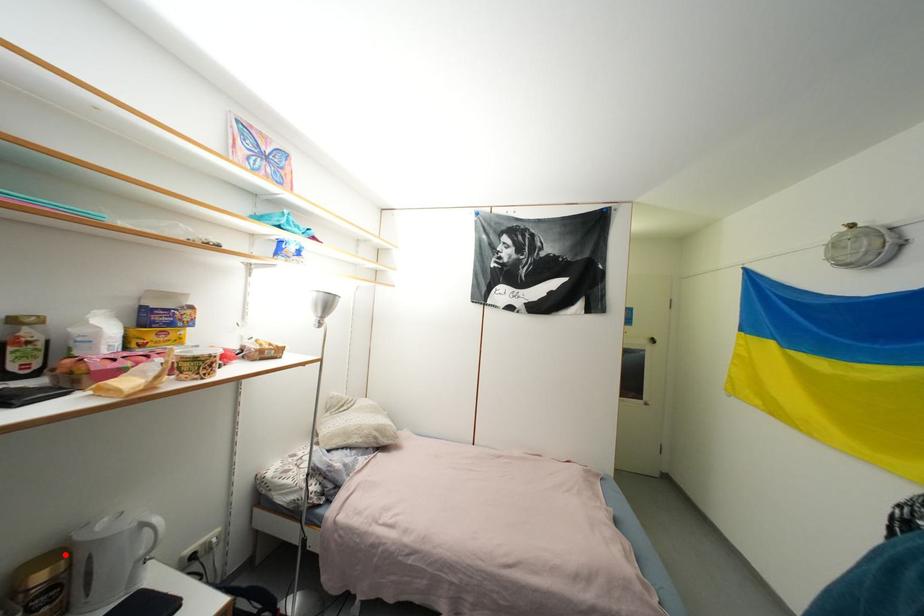
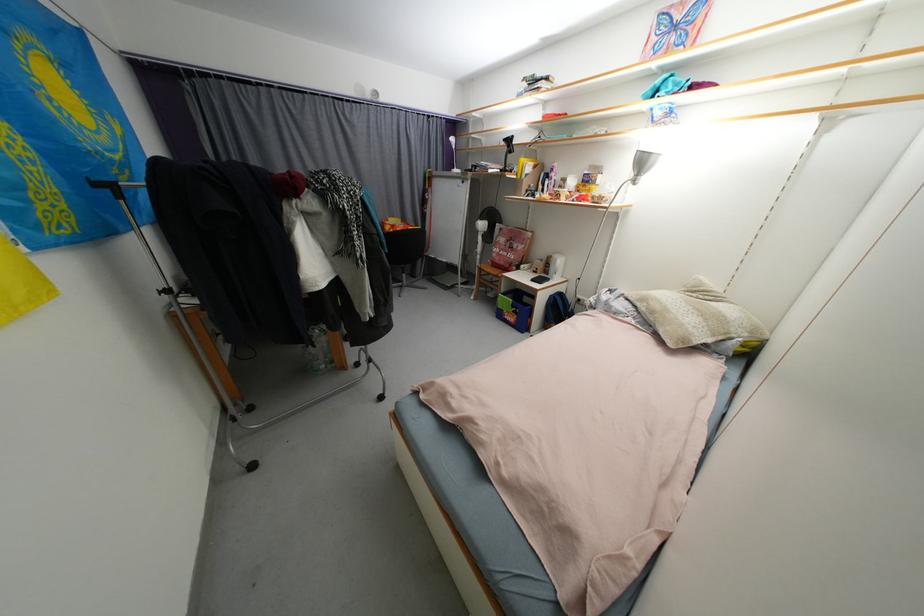
Locate, in the second image, the point that corresponds to the highlighted location in the first image.

(557, 257)